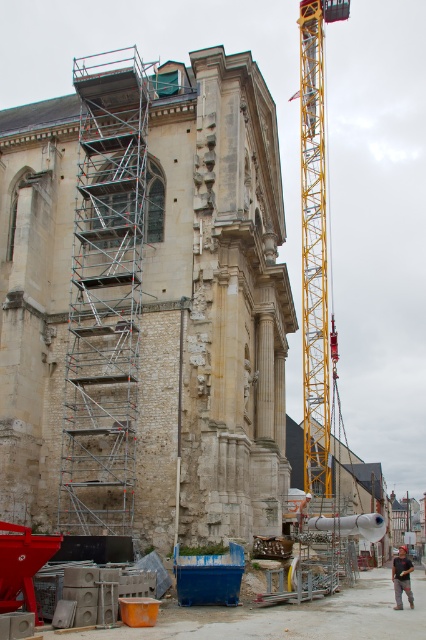
Question: Which of these objects is positioned farthest from the silver metallic scaffolding at left?

Choices:
 (A) yellow metallic crane at center
 (B) dark gray shirt at center

Answer: (A)

Question: Which object is positioned closest to the silver metallic scaffolding at left?

Choices:
 (A) dark gray shirt at center
 (B) yellow metallic crane at center

Answer: (A)

Question: Can you confirm if yellow metallic crane at center is wider than dark gray shirt at center?

Choices:
 (A) no
 (B) yes

Answer: (A)

Question: Which of the following is the farthest from the observer?

Choices:
 (A) yellow metallic crane at center
 (B) dark gray shirt at center

Answer: (A)

Question: Considering the relative positions of silver metallic scaffolding at left and dark gray shirt at center in the image provided, where is silver metallic scaffolding at left located with respect to dark gray shirt at center?

Choices:
 (A) right
 (B) left

Answer: (B)

Question: Does silver metallic scaffolding at left appear under yellow metallic crane at center?

Choices:
 (A) yes
 (B) no

Answer: (B)